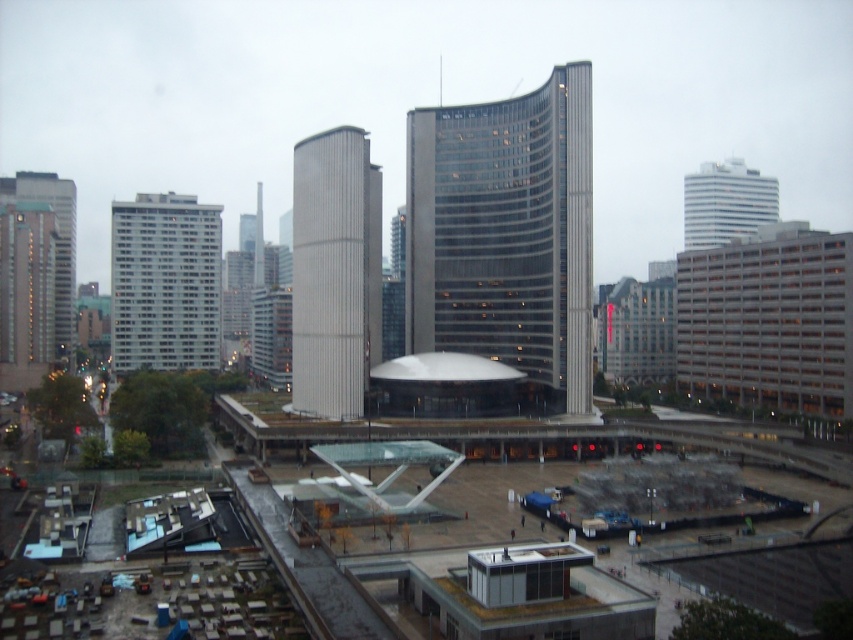
Question: Which point is farther to the camera?

Choices:
 (A) (326, 564)
 (B) (352, 264)
 (C) (194, 296)

Answer: (C)

Question: Does concrete construction site at lower left appear over smooth gray tower at center?

Choices:
 (A) yes
 (B) no

Answer: (B)

Question: Which is farther from the glassy steel tower at center?

Choices:
 (A) smooth gray tower at center
 (B) white glossy building at upper right
 (C) concrete construction site at lower left
 (D) white glossy building at left

Answer: (B)

Question: Does glassy steel tower at center have a greater width compared to white glossy building at left?

Choices:
 (A) no
 (B) yes

Answer: (A)

Question: Which object is closer to the camera taking this photo?

Choices:
 (A) glassy steel tower at center
 (B) white glossy building at left
 (C) white glossy building at upper right
 (D) concrete construction site at lower left

Answer: (D)

Question: Is concrete construction site at lower left closer to the viewer compared to smooth gray tower at center?

Choices:
 (A) no
 (B) yes

Answer: (B)